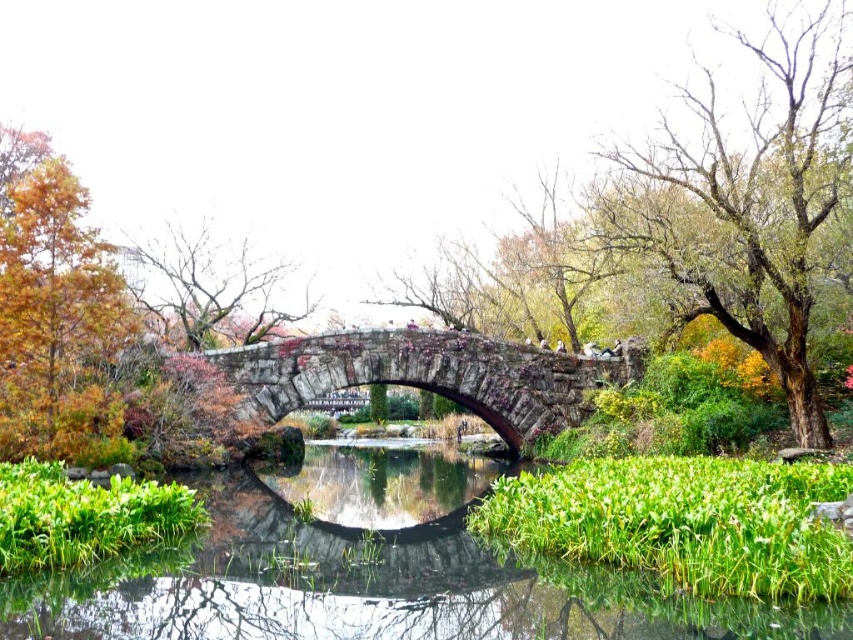
Which is more to the right, bare wood tree at upper right or orange leafy tree at left?

From the viewer's perspective, bare wood tree at upper right appears more on the right side.

What do you see at coordinates (747, 205) in the screenshot? I see `bare wood tree at upper right` at bounding box center [747, 205].

Between point (821, 179) and point (90, 316), which one is positioned behind?

The point (821, 179) is more distant.

At what (x,y) coordinates should I click in order to perform the action: click on bare wood tree at upper right. Please return your answer as a coordinate pair (x, y). The height and width of the screenshot is (640, 853). Looking at the image, I should click on (747, 205).

Is green grassy river at center smaller than bare branches at upper left?

Indeed, green grassy river at center has a smaller size compared to bare branches at upper left.

Who is lower down, green grassy river at center or bare branches at upper left?

green grassy river at center is below.

Does point (397, 580) lie in front of point (196, 248)?

Yes, it is in front of point (196, 248).

Identify the location of green grassy river at center. This screenshot has height=640, width=853. (370, 572).

Between bare wood tree at upper right and rustic stone bridge at center, which one is positioned lower?

rustic stone bridge at center is below.

Between point (753, 291) and point (258, 416), which one is positioned in front?

Point (753, 291) is more forward.

Identify the location of bare wood tree at upper right. (747, 205).

Where is `bare wood tree at upper right`? This screenshot has width=853, height=640. bare wood tree at upper right is located at coordinates (747, 205).